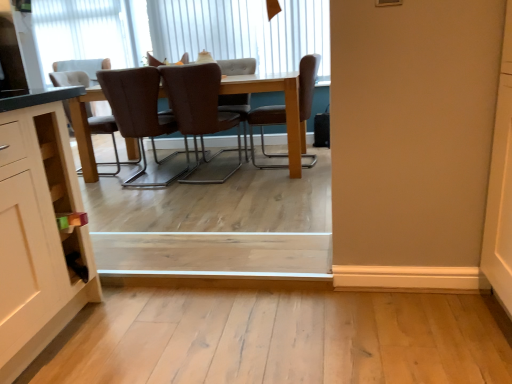
What are the coordinates of `brown leather chair at upper center, which is counted as the 4th chair, starting from the right` in the screenshot? It's located at (155, 61).

You are a GUI agent. You are given a task and a screenshot of the screen. Output one action in this format:
    pyautogui.click(x=<x>, y=<y>)
    Task: Click on the brown leather chair at center, the fifth chair positioned from the left
    
    Given the screenshot: What is the action you would take?
    pyautogui.click(x=199, y=110)

Measure the distance between point (252,128) and camera.

3.47 meters.

Identify the location of brown leather chair at center, which appears as the 3th chair when viewed from the left. The image size is (512, 384). (x=141, y=117).

Identify the location of white fabric chair at upper left, the first chair in the left-to-right sequence. Image resolution: width=512 pixels, height=384 pixels. (83, 67).

What do you see at coordinates (243, 32) in the screenshot?
I see `white vertical blinds at upper center, the 2th window viewed from the left` at bounding box center [243, 32].

You are a GUI agent. You are given a task and a screenshot of the screen. Output one action in this format:
    pyautogui.click(x=<x>, y=<y>)
    Task: Click on the brown leather chair at upper center, which is counted as the 4th chair, starting from the right
    
    Given the screenshot: What is the action you would take?
    pyautogui.click(x=155, y=61)

Which point is more forward, (x=77, y=11) or (x=308, y=84)?

The point (x=308, y=84) is closer.

Is white textured window at upper left, acting as the first window starting from the back, oriented towards brown leather chair at center, the 1th chair viewed from the right?

No, white textured window at upper left, acting as the first window starting from the back, does not turn towards brown leather chair at center, the 1th chair viewed from the right.

Is white textured window at upper left, which is counted as the first window, starting from the left, completely or partially outside of brown leather chair at center, the 1th chair viewed from the right?

That's correct, white textured window at upper left, which is counted as the first window, starting from the left, is outside of brown leather chair at center, the 1th chair viewed from the right.

From a real-world perspective, count 1st windows upward from the light wood plank at center and point to it. Please provide its 2D coordinates.

[(243, 32)]

Is light wood plank at center not within white vertical blinds at upper center, acting as the first window starting from the front?

That's correct, light wood plank at center is outside of white vertical blinds at upper center, acting as the first window starting from the front.

Which of these two, light wood plank at center or white vertical blinds at upper center, arranged as the first window when viewed from the right, is wider?

light wood plank at center.

Is white fabric chair at upper left, which is the seventh chair in right-to-left order, at the left side of light wood plank at center?

Yes.

Is there a large distance between white fabric chair at upper left, the first chair in the left-to-right sequence, and light wood plank at center?

white fabric chair at upper left, the first chair in the left-to-right sequence, is positioned a significant distance from light wood plank at center.

Can you confirm if white fabric chair at upper left, the first chair in the left-to-right sequence, is shorter than light wood plank at center?

No.

From the image's perspective, who appears lower, white fabric chair at upper left, which is the seventh chair in right-to-left order, or light wood plank at center?

light wood plank at center appears lower in the image.

Is brown fabric chair at center, positioned as the sixth chair in right-to-left order, thinner than white fabric chair at upper left, the first chair in the left-to-right sequence?

Correct, the width of brown fabric chair at center, positioned as the sixth chair in right-to-left order, is less than that of white fabric chair at upper left, the first chair in the left-to-right sequence.

From the image's perspective, which object appears higher, brown fabric chair at center, the second chair positioned from the left, or white fabric chair at upper left, the first chair in the left-to-right sequence?

white fabric chair at upper left, the first chair in the left-to-right sequence, is shown above in the image.

What's the angular difference between brown fabric chair at center, positioned as the sixth chair in right-to-left order, and white fabric chair at upper left, which is the seventh chair in right-to-left order,'s facing directions?

The angle between the facing direction of brown fabric chair at center, positioned as the sixth chair in right-to-left order, and the facing direction of white fabric chair at upper left, which is the seventh chair in right-to-left order, is 75.8 degrees.

Which of these two, brown leather chair at center, placed as the 7th chair when sorted from left to right, or white vertical blinds at upper center, the 2th window viewed from the left, is bigger?

With larger size is brown leather chair at center, placed as the 7th chair when sorted from left to right.

Is brown leather chair at center, the 1th chair viewed from the right, to the left or to the right of white vertical blinds at upper center, the second window from the top, in the image?

brown leather chair at center, the 1th chair viewed from the right, is positioned on white vertical blinds at upper center, the second window from the top,'s right side.

Can you see brown leather chair at center, the 1th chair viewed from the right, touching white vertical blinds at upper center, the first window from the bottom?

No, brown leather chair at center, the 1th chair viewed from the right, is not with white vertical blinds at upper center, the first window from the bottom.

Can you see brown leather chair at center, which ranks as the 3th chair in right-to-left order, touching brown leather chair at center, the 1th chair viewed from the right?

No, brown leather chair at center, which ranks as the 3th chair in right-to-left order, is not beside brown leather chair at center, the 1th chair viewed from the right.

From a real-world perspective, is brown leather chair at center, the fifth chair positioned from the left, positioned above or below brown leather chair at center, the 1th chair viewed from the right?

brown leather chair at center, the fifth chair positioned from the left, is situated higher than brown leather chair at center, the 1th chair viewed from the right, in the real world.

Who is bigger, brown leather chair at center, which ranks as the 3th chair in right-to-left order, or brown leather chair at center, the 1th chair viewed from the right?

With larger size is brown leather chair at center, the 1th chair viewed from the right.

How many degrees apart are the facing directions of brown leather chair at center, the fifth chair positioned from the left, and brown leather chair at center, the 1th chair viewed from the right?

They differ by 87.7 degrees in their facing directions.

Do you think brown leather chair at upper center, which is counted as the 4th chair, starting from the right, is within brown leather chair at center, the 1th chair viewed from the right, or outside of it?

brown leather chair at upper center, which is counted as the 4th chair, starting from the right, is not enclosed by brown leather chair at center, the 1th chair viewed from the right.

Between brown leather chair at upper center, which is counted as the 4th chair, starting from the right, and brown leather chair at center, placed as the 7th chair when sorted from left to right, which one has more height?

brown leather chair at center, placed as the 7th chair when sorted from left to right, is taller.

Can you confirm if brown leather chair at upper center, which is counted as the 4th chair, starting from the right, is wider than brown leather chair at center, placed as the 7th chair when sorted from left to right?

No.

Is brown leather chair at upper center, which is counted as the 4th chair, starting from the right, aimed at brown leather chair at center, the 1th chair viewed from the right?

No.

From the image's perspective, starting from the brown leather chair at center, placed as the 7th chair when sorted from left to right, which window is the 2nd one above? Please provide its 2D coordinates.

[(83, 32)]

Image resolution: width=512 pixels, height=384 pixels. In order to click on plank below the white vertical blinds at upper center, the second window from the top (from the image's perspective) in this screenshot , I will do point(213,254).

Based on their spatial positions, is brown leather chair at center, which ranks as the 3th chair in right-to-left order, or brown leather chair at center, which appears as the 3th chair when viewed from the left, closer to white vertical blinds at upper center, acting as the first window starting from the front?

The object closer to white vertical blinds at upper center, acting as the first window starting from the front, is brown leather chair at center, which ranks as the 3th chair in right-to-left order.

When comparing their distances from white fabric chair at upper left, the first chair in the left-to-right sequence, does brown leather chair at center, the 1th chair viewed from the right, or white textured window at upper left, marked as the second window in a front-to-back arrangement, seem closer?

white textured window at upper left, marked as the second window in a front-to-back arrangement, is closer to white fabric chair at upper left, the first chair in the left-to-right sequence.

Considering their positions, is white vertical blinds at upper center, the 2th window from the back, positioned further to light wood plank at center than white textured window at upper left, which is the 1th window in top-to-bottom order?

Based on the image, white textured window at upper left, which is the 1th window in top-to-bottom order, appears to be further to light wood plank at center.

Which object lies further to the anchor point brown leather chair at center, placed as the 7th chair when sorted from left to right, brown leather chair at center, the second chair from the right, or brown fabric chair at center, the second chair positioned from the left?

brown fabric chair at center, the second chair positioned from the left, lies further to brown leather chair at center, placed as the 7th chair when sorted from left to right, than the other object.

Estimate the real-world distances between objects in this image. Which object is closer to brown leather chair at center, placed as the 7th chair when sorted from left to right, brown leather chair at upper center, which is counted as the fourth chair, starting from the left, or brown leather chair at center, which ranks as the 3th chair in right-to-left order?

brown leather chair at center, which ranks as the 3th chair in right-to-left order, is positioned closer to the anchor brown leather chair at center, placed as the 7th chair when sorted from left to right.

Which object lies further to the anchor point brown leather chair at upper center, which is counted as the fourth chair, starting from the left, light wood plank at center or brown leather chair at center, which appears as the 3th chair when viewed from the left?

light wood plank at center is further to brown leather chair at upper center, which is counted as the fourth chair, starting from the left.

Considering their positions, is white fabric chair at upper left, which is the seventh chair in right-to-left order, positioned further to brown leather chair at upper center, which is counted as the fourth chair, starting from the left, than brown leather chair at center, the second chair from the right?

brown leather chair at center, the second chair from the right.

Considering their positions, is white textured window at upper left, which is counted as the 2th window, starting from the bottom, positioned further to brown leather chair at upper center, which is counted as the 4th chair, starting from the right, than brown fabric chair at center, positioned as the sixth chair in right-to-left order?

white textured window at upper left, which is counted as the 2th window, starting from the bottom, is further to brown leather chair at upper center, which is counted as the 4th chair, starting from the right.

Where is `window between white textured window at upper left, acting as the first window starting from the back, and brown leather chair at center, the 1th chair viewed from the right, from left to right`? The height and width of the screenshot is (384, 512). window between white textured window at upper left, acting as the first window starting from the back, and brown leather chair at center, the 1th chair viewed from the right, from left to right is located at coordinates (243, 32).

Find the location of a particular element. The width and height of the screenshot is (512, 384). window between light wood plank at center and white fabric chair at upper left, the first chair in the left-to-right sequence, in the front-back direction is located at coordinates (x=243, y=32).

The height and width of the screenshot is (384, 512). Find the location of `chair between white vertical blinds at upper center, the first window from the bottom, and brown leather chair at center, the second chair from the right, from top to bottom`. chair between white vertical blinds at upper center, the first window from the bottom, and brown leather chair at center, the second chair from the right, from top to bottom is located at coordinates (155, 61).

Locate an element on the screen. The image size is (512, 384). window between brown leather chair at center, the 5th chair when ordered from right to left, and white textured window at upper left, which is counted as the 2th window, starting from the bottom, from front to back is located at coordinates (243, 32).